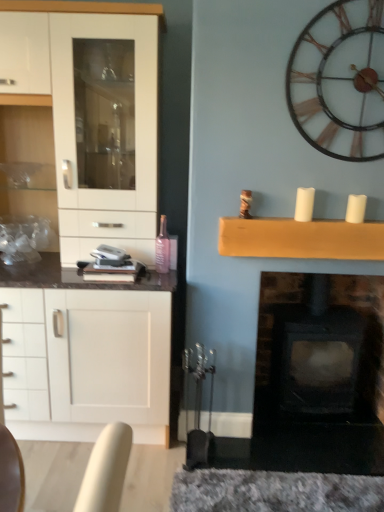
The image size is (384, 512). I want to click on vacant area on top of wooden mantle at upper center (from a real-world perspective), so click(x=337, y=215).